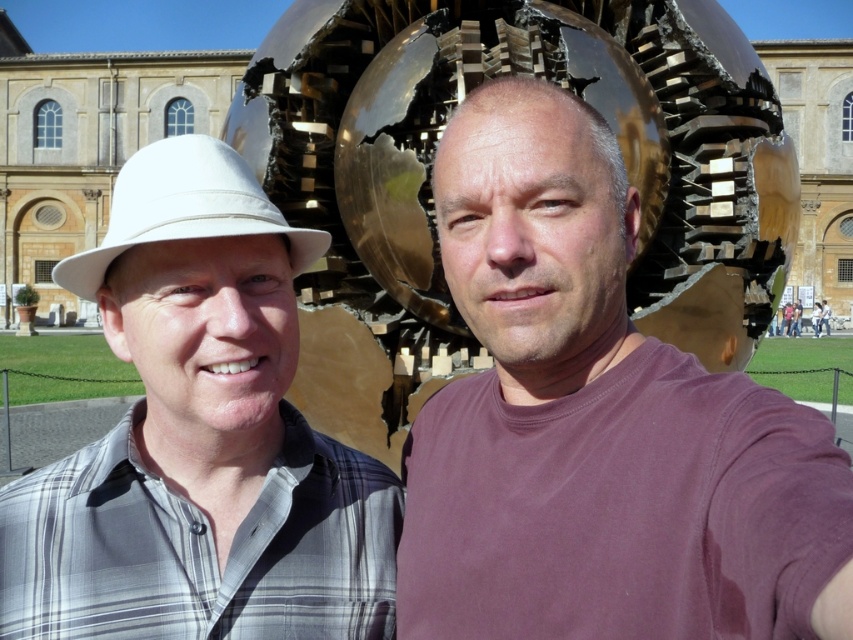
You are taking a photo of the gold reflective globe at center and the white fabric baseball hat at left. Which object should you focus on first if you want to ensure both are in sharp focus?

The gold reflective globe at center is larger than the white fabric baseball hat at left, so focusing on the gold reflective globe at center first will help ensure both are in sharp focus.

You are trying to take a photo of the gold reflective globe at center and the white fabric baseball hat at left. Which object should you focus on if you want to capture the larger subject in your shot?

The gold reflective globe at center should be focused on because it is larger than the white fabric baseball hat at left.